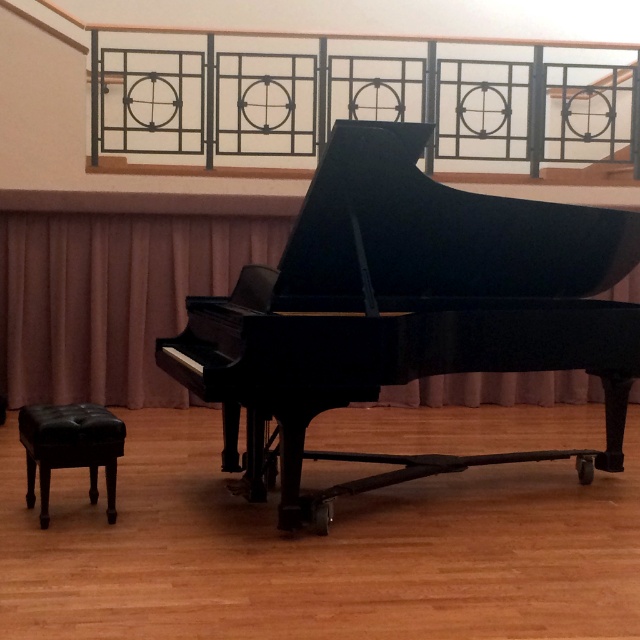
Question: Can you confirm if metallic black railing at upper center is positioned to the right of black leather stool at lower left?

Choices:
 (A) yes
 (B) no

Answer: (A)

Question: Does black polished piano at center appear on the left side of black leather stool at lower left?

Choices:
 (A) yes
 (B) no

Answer: (B)

Question: Which object is positioned closest to the black polished piano at center?

Choices:
 (A) black leather stool at lower left
 (B) metallic black railing at upper center
 (C) matte pink curtain at center

Answer: (A)

Question: Among these objects, which one is nearest to the camera?

Choices:
 (A) black polished piano at center
 (B) black leather stool at lower left
 (C) metallic black railing at upper center

Answer: (A)

Question: Which is nearer to the black polished piano at center?

Choices:
 (A) matte pink curtain at center
 (B) metallic black railing at upper center

Answer: (B)

Question: Can you confirm if black polished piano at center is positioned below black leather stool at lower left?

Choices:
 (A) no
 (B) yes

Answer: (A)